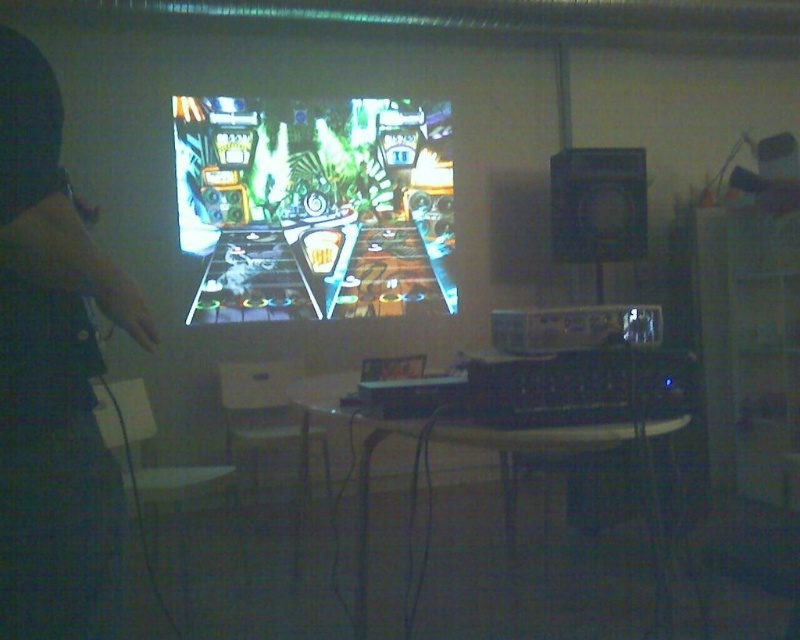
You are a game developer testing a new pinball game. You notice the dark fabric hand at left and the shiny plastic pinball machine at center in the room. For safety, you need to ensure there is at least 3 meters between the hand and the machine. Is the current distance sufficient?

The distance between the dark fabric hand at left and the shiny plastic pinball machine at center is 3.20 meters, which is more than the required 3 meters, so the safety distance is sufficient.

You are a game designer observing the scene. You notice the dark fabric hand at left and the shiny plastic pinball machine at center. Which object is located below the other?

The dark fabric hand at left is positioned under the shiny plastic pinball machine at center, so the dark fabric hand at left is below the shiny plastic pinball machine at center.

You are a game tester who needs to adjust the shiny plastic pinball machine at center. You see the dark fabric hand at left near your side. Which object is closer to you?

The dark fabric hand at left is closer to the viewer than the shiny plastic pinball machine at center, so the dark fabric hand at left is closer to you.